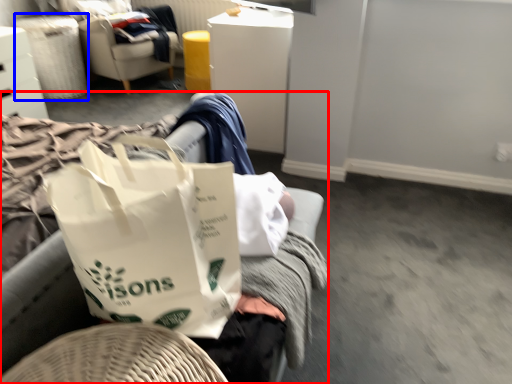
Question: Among these objects, which one is farthest to the camera, furniture (highlighted by a red box) or laundry basket (highlighted by a blue box)?

Choices:
 (A) furniture
 (B) laundry basket

Answer: (B)